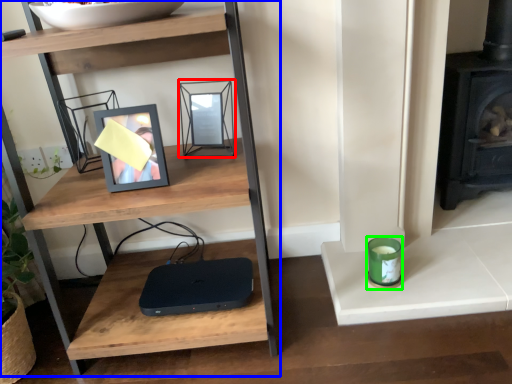
Question: Based on their relative distances, which object is farther from picture frame (highlighted by a red box)? Choose from shelf (highlighted by a blue box) and candle holder (highlighted by a green box).

Choices:
 (A) shelf
 (B) candle holder

Answer: (B)